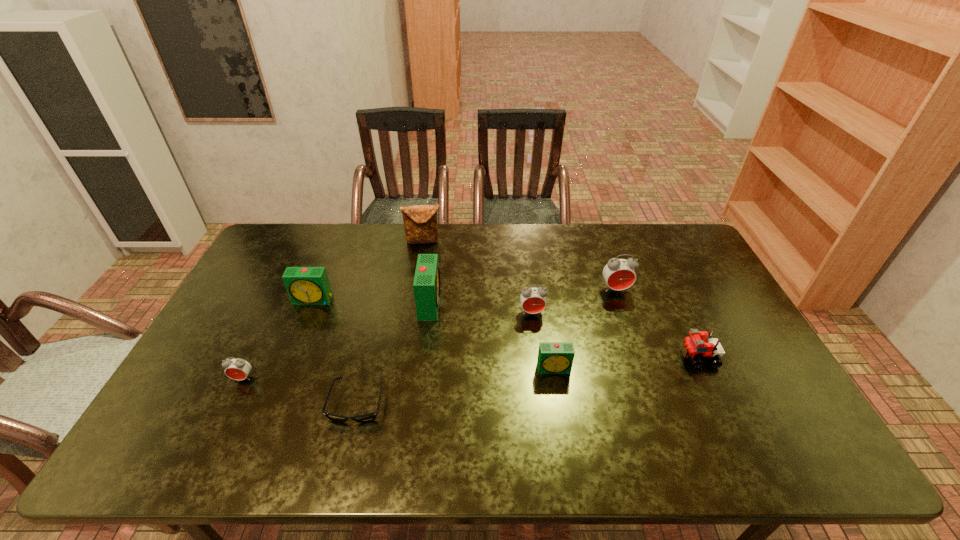
This screenshot has height=540, width=960. Identify the location of clutch bag. (420, 222).

At what (x,y) coordinates should I click in order to perform the action: click on the biggest red alarm clock. Please return your answer as a coordinate pair (x, y). The width and height of the screenshot is (960, 540). Looking at the image, I should click on (619, 274).

The image size is (960, 540). What are the coordinates of `the rightmost red alarm clock` in the screenshot? It's located at [619, 274].

Where is `the third alarm clock from left to right`? This screenshot has height=540, width=960. the third alarm clock from left to right is located at coordinates (x=426, y=285).

Locate an element on the screen. This screenshot has height=540, width=960. the biggest green alarm clock is located at coordinates (426, 285).

In order to click on the second red alarm clock from left to right in this screenshot , I will do `click(533, 300)`.

Where is `the second farthest red alarm clock`? Image resolution: width=960 pixels, height=540 pixels. the second farthest red alarm clock is located at coordinates (533, 300).

Locate an element on the screen. the fifth alarm clock from right to left is located at coordinates (305, 285).

Locate an element on the screen. the second object from left to right is located at coordinates (305, 285).

This screenshot has height=540, width=960. I want to click on the rightmost object, so click(693, 347).